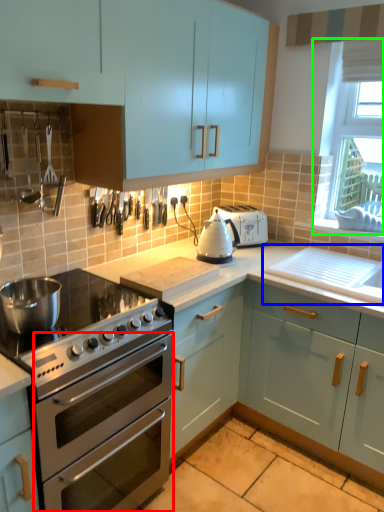
Question: Which object is the farthest from oven (highlighted by a red box)? Choose among these: sink (highlighted by a blue box) or window screen (highlighted by a green box).

Choices:
 (A) sink
 (B) window screen

Answer: (B)